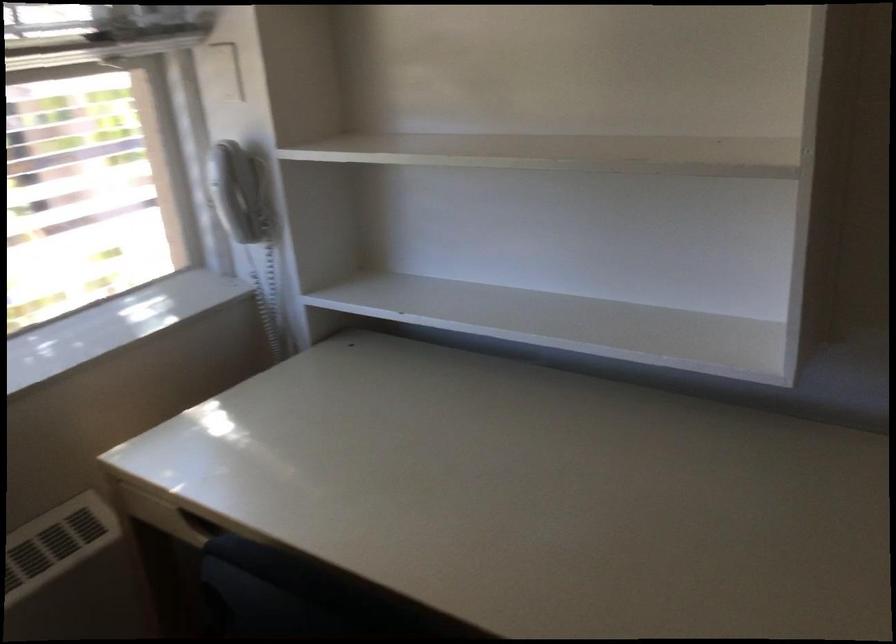
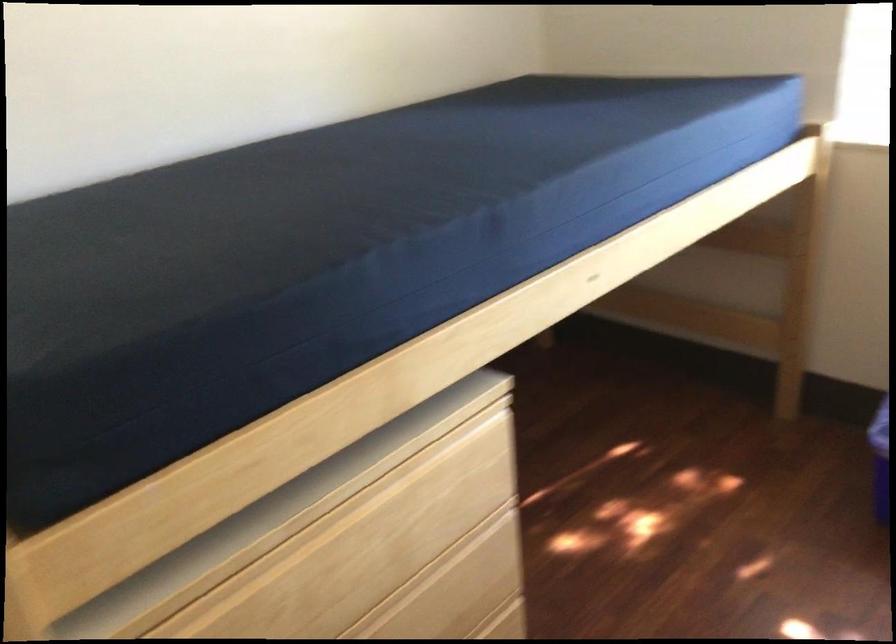
First-person continuous shooting, in which direction is the camera rotating?

The camera rotated toward left-down.